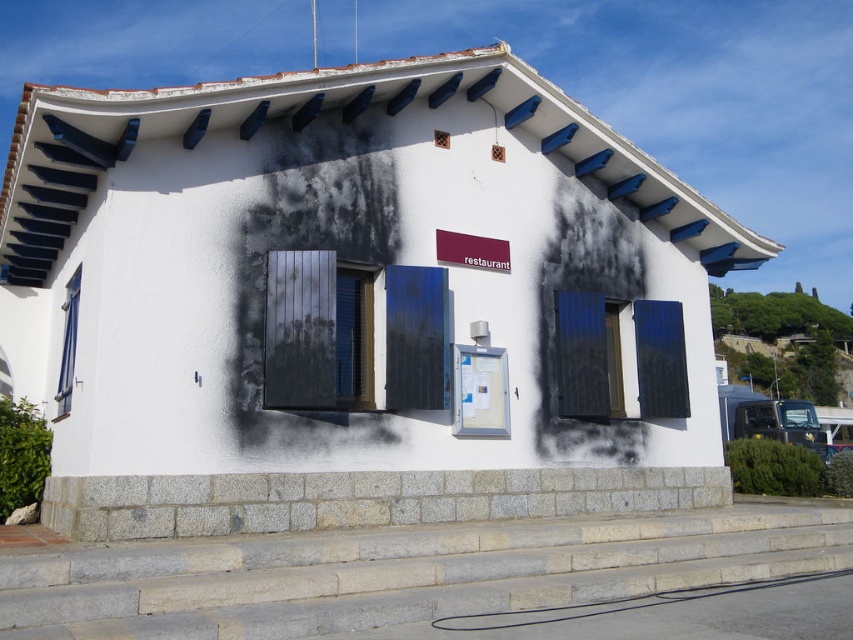
You are a painter standing at the base of the steps. You need to paint both the matte black shutter at center and the matte wood window at left. Given that your ladder can extend up to 3 meters, can you reach both objects without moving the ladder?

The distance between the matte black shutter at center and the matte wood window at left is 2.82 meters, so yes, the ladder can reach both objects since the distance is within the ladder extension limit.

You are standing in front of the building and notice a point marked at coordinates [582,355]. What object does this point correspond to?

The point at coordinates [582,355] corresponds to the matte black window at center.

Consider the image. You are a contractor assessing the building for repairs. You need to order materials for the matte black window at center and the matte wood shutter at center. Which object requires a larger quantity of materials based on their widths?

The matte black window at center requires a larger quantity of materials because its width surpasses that of the matte wood shutter at center.